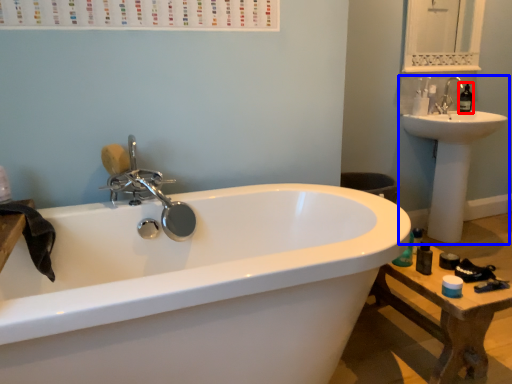
Question: Which point is further to the camera, soap dispenser (highlighted by a red box) or sink (highlighted by a blue box)?

Choices:
 (A) soap dispenser
 (B) sink

Answer: (A)